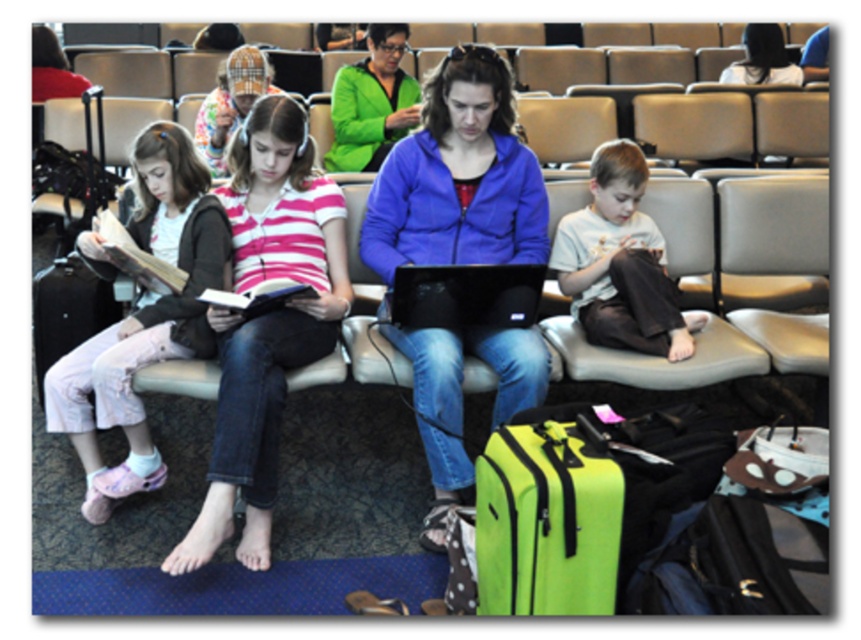
This screenshot has height=640, width=861. In order to click on neon green fabric suitcase at lower center in this screenshot , I will do `click(546, 522)`.

At what (x,y) coordinates should I click in order to perform the action: click on neon green fabric suitcase at lower center. Please return your answer as a coordinate pair (x, y). Looking at the image, I should click on (546, 522).

Does matte black suitcase at left appear under plaid fabric headscarf at upper center?

Indeed, matte black suitcase at left is positioned under plaid fabric headscarf at upper center.

In the scene shown: Does matte black suitcase at left appear over plaid fabric headscarf at upper center?

Actually, matte black suitcase at left is below plaid fabric headscarf at upper center.

Locate an element on the screen. The width and height of the screenshot is (861, 640). matte black suitcase at left is located at coordinates (67, 310).

Between pink fabric pants at left and plaid fabric headscarf at upper center, which one is positioned lower?

Positioned lower is pink fabric pants at left.

Locate an element on the screen. The image size is (861, 640). pink fabric pants at left is located at coordinates (143, 320).

Where is `pink fabric pants at left`? This screenshot has width=861, height=640. pink fabric pants at left is located at coordinates (143, 320).

Identify the location of pink fabric pants at left. The width and height of the screenshot is (861, 640). (143, 320).